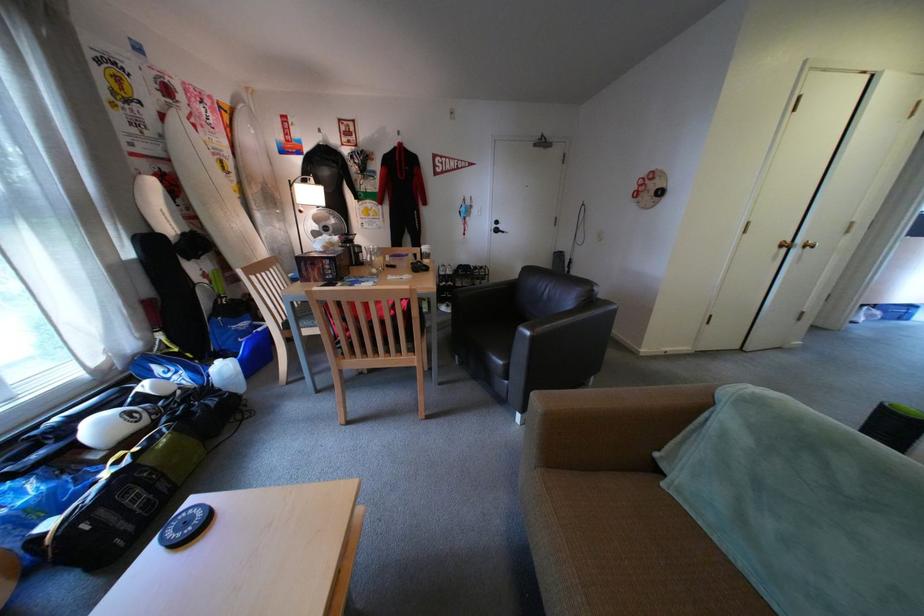
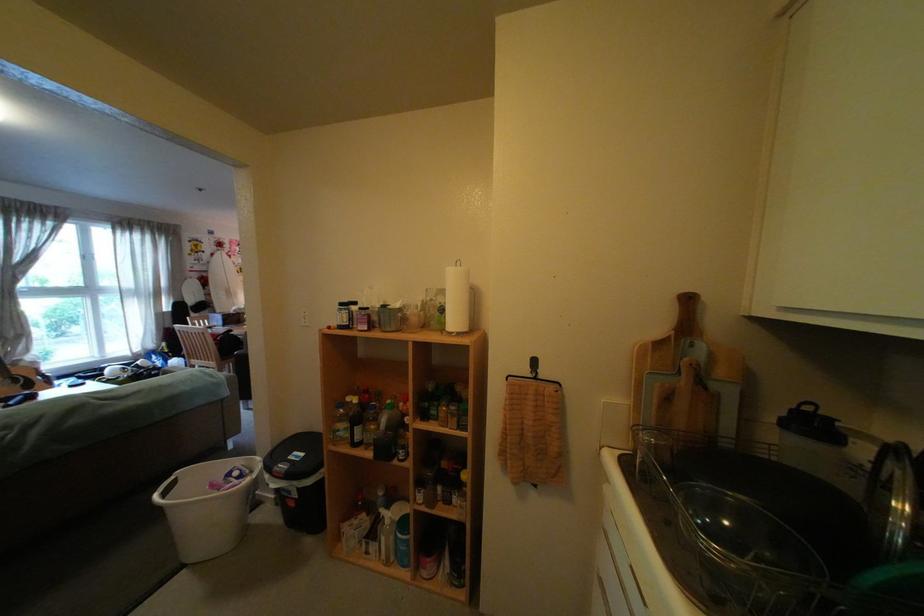
Question: I am providing you with two images of the same scene from different viewpoints. After the viewpoint changes to image2, which objects are now occluded?

Choices:
 (A) black circular coaster
 (B) white tray
 (C) pot lid handle
 (D) paper towel roll

Answer: (A)